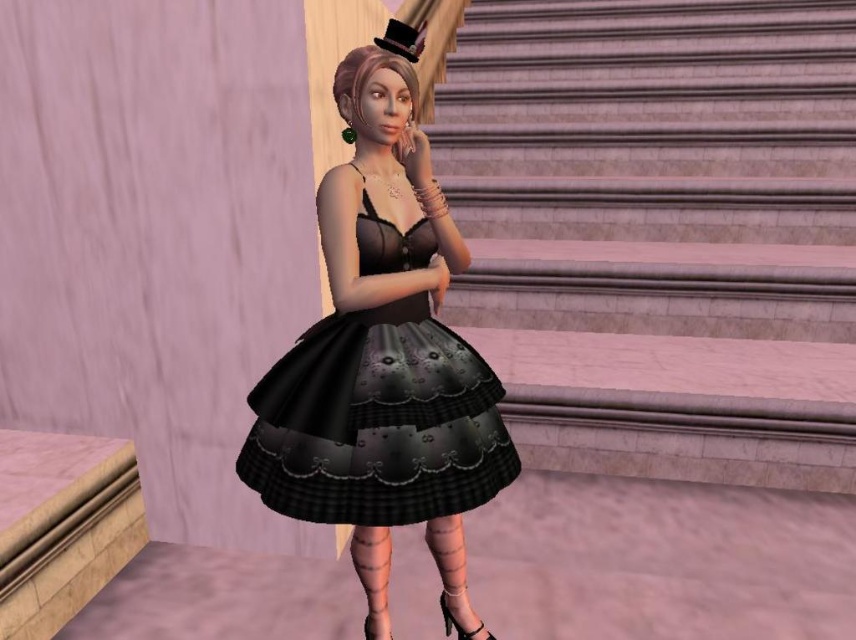
From the picture: Which of these two, black satin dress at center or black felt top hat at upper center, stands taller?

black satin dress at center is taller.

Between black satin dress at center and black felt top hat at upper center, which one is positioned higher?

Positioned higher is black felt top hat at upper center.

Who is more distant from viewer, (405,497) or (397,33)?

Point (397,33)

The height and width of the screenshot is (640, 856). I want to click on black satin dress at center, so click(x=377, y=420).

Which is more to the left, marble stairs at center or black felt top hat at upper center?

black felt top hat at upper center

Does point (522, 65) come in front of point (418, 28)?

No, (522, 65) is further to viewer.

Between point (507, 404) and point (419, 49), which one is positioned behind?

Point (507, 404)

This screenshot has width=856, height=640. Identify the location of marble stairs at center. (660, 232).

How much distance is there between marble stairs at center and black satin dress at center?

A distance of 1.45 meters exists between marble stairs at center and black satin dress at center.

What do you see at coordinates (660, 232) in the screenshot?
I see `marble stairs at center` at bounding box center [660, 232].

Is point (749, 481) positioned before point (500, 451)?

No.

The height and width of the screenshot is (640, 856). I want to click on marble stairs at center, so click(x=660, y=232).